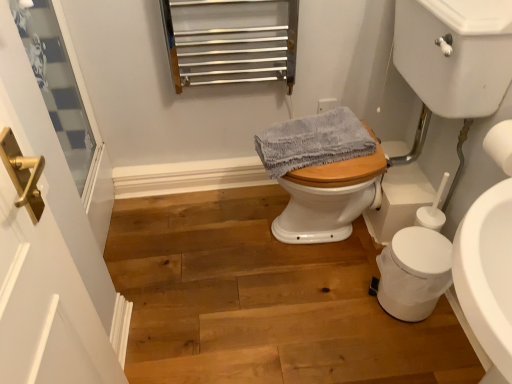
You are a GUI agent. You are given a task and a screenshot of the screen. Output one action in this format:
    pyautogui.click(x=<x>, y=<y>)
    Task: Click on the unoccupied space behind white matte trash can at lower right
    
    Given the screenshot: What is the action you would take?
    pyautogui.click(x=361, y=257)